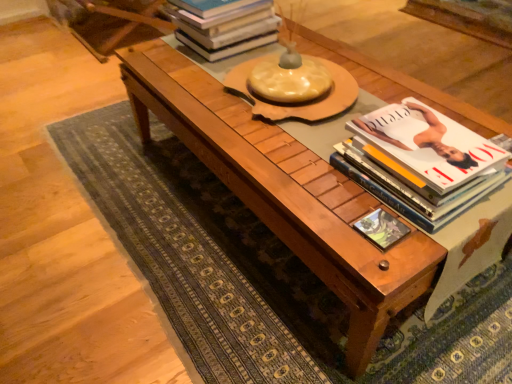
This screenshot has height=384, width=512. I want to click on free space that is to the left of matte green book at center, so coord(321,220).